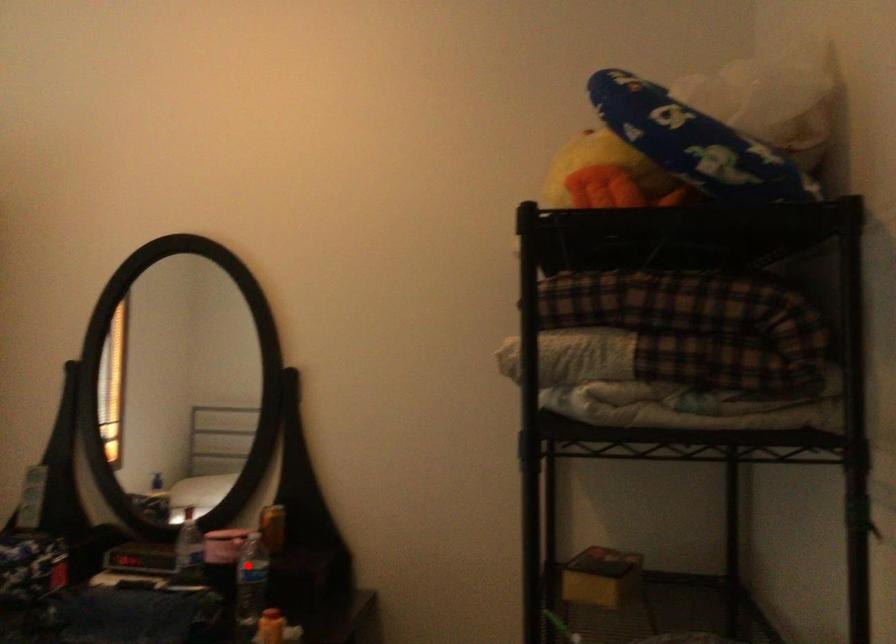
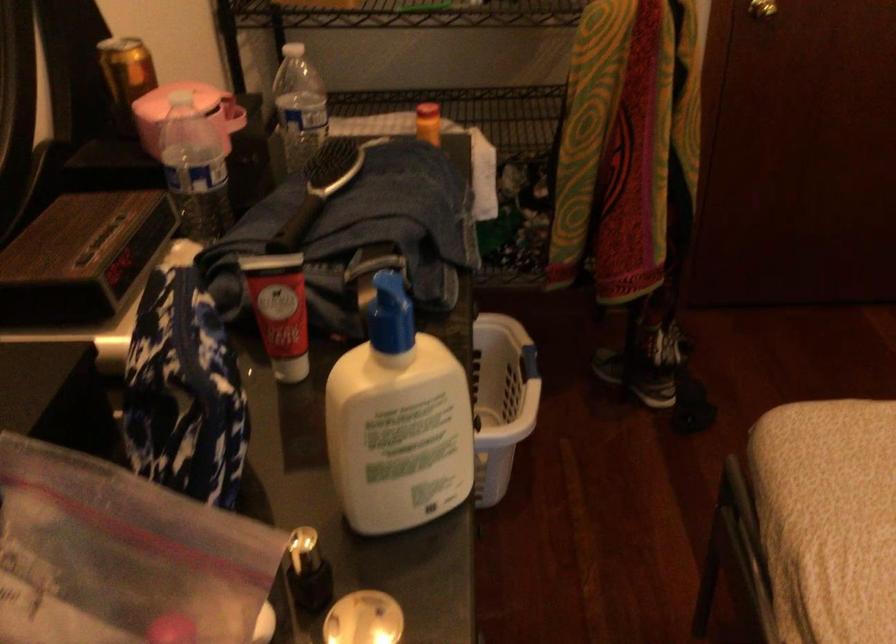
Question: I am providing you with two images of the same scene from different viewpoints. Given a red point in image1, look at the same physical point in image2. Is it:

Choices:
 (A) Closer to the viewpoint
 (B) Farther from the viewpoint

Answer: (A)